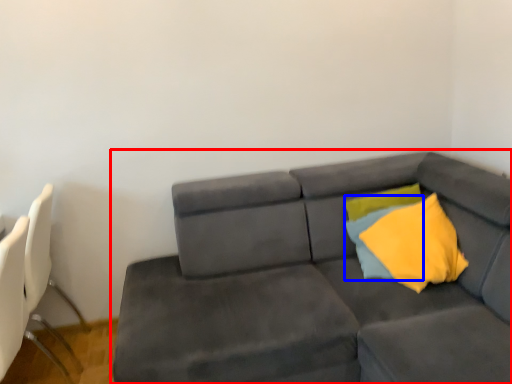
Question: Which point is further to the camera, studio couch (highlighted by a red box) or pillow (highlighted by a blue box)?

Choices:
 (A) studio couch
 (B) pillow

Answer: (B)